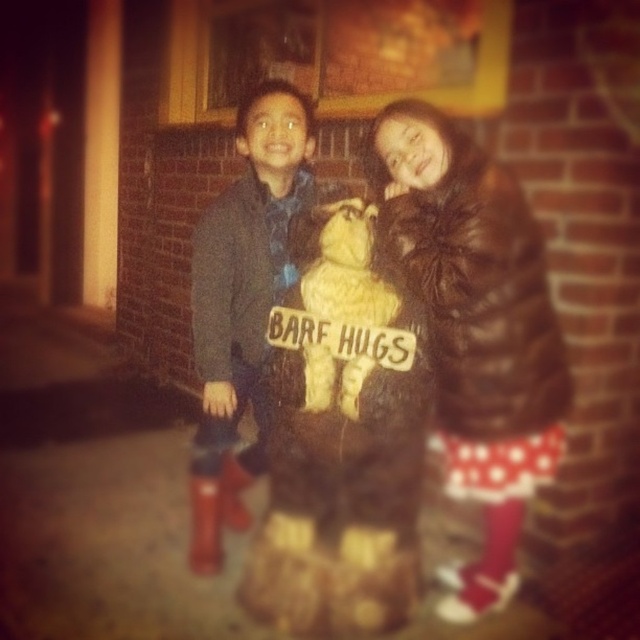
You are a photographer trying to capture the teddy bear at point (368, 360) in the image. The teddy bear is between two children. Which child is the teddy bear closer to?

The teddy bear at center is located at point (368, 360), so it is between the two children. However, the exact distance to each child isn

You are a photographer trying to capture a clear photo of both the fuzzy brown teddy bear at center and the fuzzy beige stuffed bear at center. Which bear should you focus on first to ensure both are in focus?

You should focus on the fuzzy beige stuffed bear at center first because it is above the fuzzy brown teddy bear at center, so adjusting focus from top to bottom will help both be in focus.

You are a photographer trying to capture a photo of the two children in front of the brick wall. You want to ensure both the matte blue jacket at center and the fuzzy beige stuffed bear at center are clearly visible in the frame. Which object should you position closer to the left side of the camera frame to achieve this?

The matte blue jacket at center should be positioned closer to the left side of the camera frame since it is already on the left side of the fuzzy beige stuffed bear at center, ensuring both are visible.